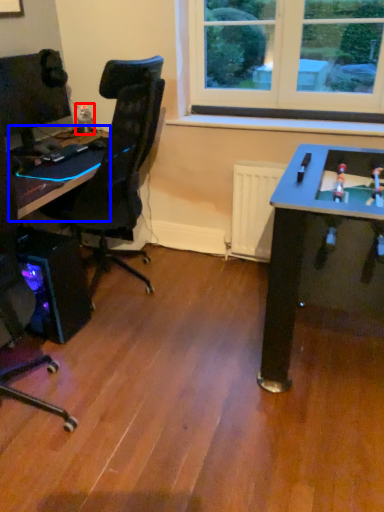
Question: Which object is closer to the camera taking this photo, toy (highlighted by a red box) or table (highlighted by a blue box)?

Choices:
 (A) toy
 (B) table

Answer: (B)